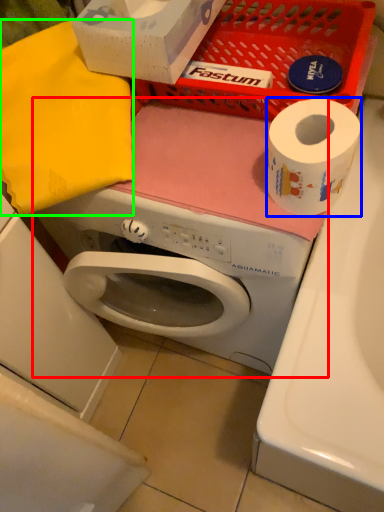
Question: Which is nearer to the washing machine (highlighted by a red box)? toilet paper (highlighted by a blue box) or clothe (highlighted by a green box).

Choices:
 (A) toilet paper
 (B) clothe

Answer: (B)